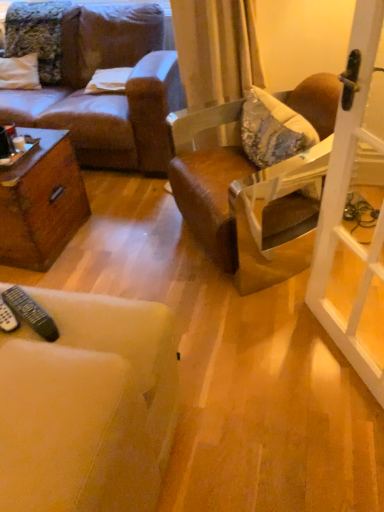
Question: From a real-world perspective, relative to brown leather chair at center, is black plastic remote at lower left, arranged as the first remote control when viewed from the right, vertically above or below?

Choices:
 (A) below
 (B) above

Answer: (B)

Question: From the image's perspective, is black plastic remote at lower left, which ranks as the second remote control in left-to-right order, positioned above or below brown leather chair at center?

Choices:
 (A) below
 (B) above

Answer: (A)

Question: Considering the real-world distances, which object is closest to the black plastic remote at lower left, arranged as the first remote control when viewed from the right?

Choices:
 (A) white fabric pillow at upper center
 (B) white glass screen door at right
 (C) brown leather chair at center
 (D) black plastic remote control at lower left, which is counted as the first remote control, starting from the left

Answer: (D)

Question: Which object is positioned closest to the brown leather chair at center?

Choices:
 (A) black plastic remote at lower left, which ranks as the second remote control in left-to-right order
 (B) white fabric pillow at upper center
 (C) black plastic remote control at lower left, which is counted as the first remote control, starting from the left
 (D) white glass screen door at right

Answer: (D)